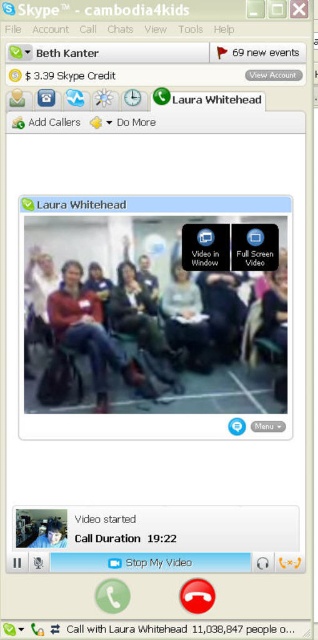
You are participating in a video call and want to pan your camera to focus on two specific points in the room. The first point is at coordinates point (206, 321) and the second is at point (49, 525). Which point is closer to the camera?

Point (49, 525) is closer to the camera because the description states that point (206, 321) is behind point (49, 525).

You are a user trying to identify the position of the matte red sweater in the video call. According to the Skype interface coordinates, where is the matte red sweater at center positioned?

The matte red sweater at center is located at point (x=88, y=332) according to the Skype interface coordinates.

You are trying to locate the matte black laptop at center in the Skype interface. According to the coordinates provided, where should you look on the screen?

The matte black laptop at center is located at point coordinates (186, 320) on the screen.